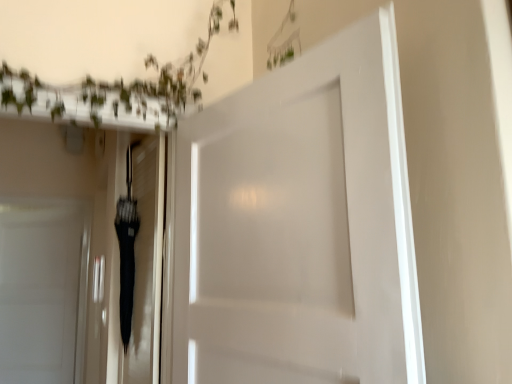
Describe the element at coordinates (42, 290) in the screenshot. The width and height of the screenshot is (512, 384). I see `white matte door at left, the first door positioned from the back` at that location.

What do you see at coordinates (300, 225) in the screenshot? I see `white matte door at center, positioned as the second door in left-to-right order` at bounding box center [300, 225].

Find the location of a particular element. Image resolution: width=512 pixels, height=384 pixels. white matte door at left, the first door positioned from the back is located at coordinates [42, 290].

From the picture: Measure the distance between white matte door at center, positioned as the second door in left-to-right order, and black glossy umbrella at center.

They are 56.75 centimeters apart.

From the image's perspective, is white matte door at center, positioned as the second door in left-to-right order, on top of black glossy umbrella at center?

Yes.

Is white matte door at center, placed as the first door when sorted from right to left, wider or thinner than black glossy umbrella at center?

Clearly, white matte door at center, placed as the first door when sorted from right to left, has more width compared to black glossy umbrella at center.

Is white matte door at center, placed as the first door when sorted from right to left, turned away from black glossy umbrella at center?

No, white matte door at center, placed as the first door when sorted from right to left, is not facing the opposite direction of black glossy umbrella at center.

Who is smaller, white matte door at left, the first door positioned from the back, or white matte door at center, placed as the first door when sorted from right to left?

white matte door at left, the first door positioned from the back.

Is white matte door at left, arranged as the first door when viewed from the left, positioned before white matte door at center, positioned as the second door in left-to-right order?

That is False.

Visually, is white matte door at left, the first door positioned from the back, positioned to the left or to the right of white matte door at center, acting as the 1th door starting from the front?

Result: white matte door at left, the first door positioned from the back, is to the left of white matte door at center, acting as the 1th door starting from the front.

This screenshot has width=512, height=384. I want to click on door behind the black glossy umbrella at center, so click(x=42, y=290).

Which of these two, white matte door at left, the second door when ordered from front to back, or black glossy umbrella at center, is wider?

black glossy umbrella at center.

Would you say white matte door at left, arranged as the first door when viewed from the left, is inside or outside black glossy umbrella at center?

white matte door at left, arranged as the first door when viewed from the left, exists outside the volume of black glossy umbrella at center.

Is white matte door at left, the second door when ordered from front to back, facing towards black glossy umbrella at center?

No, white matte door at left, the second door when ordered from front to back, does not turn towards black glossy umbrella at center.

Considering the relative positions of black glossy umbrella at center and white matte door at left, the first door positioned from the back, in the image provided, is black glossy umbrella at center to the left of white matte door at left, the first door positioned from the back, from the viewer's perspective?

No, black glossy umbrella at center is not to the left of white matte door at left, the first door positioned from the back.

From the image's perspective, is black glossy umbrella at center on white matte door at left, arranged as the second door when viewed from the right?

Yes.

From a real-world perspective, is black glossy umbrella at center under white matte door at left, arranged as the second door when viewed from the right?

Incorrect, from a real-world perspective, black glossy umbrella at center is higher than white matte door at left, arranged as the second door when viewed from the right.

Is black glossy umbrella at center positioned beyond the bounds of white matte door at left, the second door when ordered from front to back?

Yes.

Which point is more forward, (138,173) or (308,354)?

The point (308,354) is in front.

Is black glossy umbrella at center completely or partially outside of white matte door at center, the second door from the back?

That's correct, black glossy umbrella at center is outside of white matte door at center, the second door from the back.

Considering the relative sizes of black glossy umbrella at center and white matte door at center, the second door from the back, in the image provided, is black glossy umbrella at center smaller than white matte door at center, the second door from the back,?

Correct, black glossy umbrella at center occupies less space than white matte door at center, the second door from the back.

How much distance is there between black glossy umbrella at center and white matte door at center, the second door from the back?

They are 56.75 centimeters apart.

Between point (260, 275) and point (75, 216), which one is positioned in front?

Point (260, 275)

Is white matte door at center, placed as the first door when sorted from right to left, in front of or behind white matte door at left, arranged as the first door when viewed from the left, in the image?

Clearly, white matte door at center, placed as the first door when sorted from right to left, is in front of white matte door at left, arranged as the first door when viewed from the left.

Which object is wider, white matte door at center, placed as the first door when sorted from right to left, or white matte door at left, arranged as the second door when viewed from the right?

With larger width is white matte door at center, placed as the first door when sorted from right to left.

Looking at this image, is white matte door at center, placed as the first door when sorted from right to left, aimed at white matte door at left, arranged as the first door when viewed from the left?

No, white matte door at center, placed as the first door when sorted from right to left, is not aimed at white matte door at left, arranged as the first door when viewed from the left.

Image resolution: width=512 pixels, height=384 pixels. Find the location of `door located in front of the black glossy umbrella at center`. door located in front of the black glossy umbrella at center is located at coordinates (300, 225).

This screenshot has height=384, width=512. I want to click on door behind the white matte door at center, the second door from the back, so click(x=42, y=290).

Which object lies nearer to the anchor point white matte door at center, positioned as the second door in left-to-right order, black glossy umbrella at center or white matte door at left, arranged as the first door when viewed from the left?

black glossy umbrella at center lies closer to white matte door at center, positioned as the second door in left-to-right order, than the other object.

Estimate the real-world distances between objects in this image. Which object is closer to white matte door at center, positioned as the second door in left-to-right order, white matte door at left, arranged as the second door when viewed from the right, or black glossy umbrella at center?

Among the two, black glossy umbrella at center is located nearer to white matte door at center, positioned as the second door in left-to-right order.

Looking at this image, considering their positions, is white matte door at left, arranged as the first door when viewed from the left, positioned further to black glossy umbrella at center than white matte door at center, acting as the 1th door starting from the front?

white matte door at left, arranged as the first door when viewed from the left, is positioned further to the anchor black glossy umbrella at center.

Looking at the image, which one is located further to black glossy umbrella at center, white matte door at center, placed as the first door when sorted from right to left, or white matte door at left, arranged as the first door when viewed from the left?

white matte door at left, arranged as the first door when viewed from the left, is further to black glossy umbrella at center.

Considering their positions, is white matte door at center, the second door from the back, positioned closer to white matte door at left, arranged as the first door when viewed from the left, than black glossy umbrella at center?

Among the two, black glossy umbrella at center is located nearer to white matte door at left, arranged as the first door when viewed from the left.

When comparing their distances from white matte door at left, the second door when ordered from front to back, does black glossy umbrella at center or white matte door at center, the second door from the back, seem closer?

The object closer to white matte door at left, the second door when ordered from front to back, is black glossy umbrella at center.

Where is `elevator positioned between white matte door at center, the second door from the back, and white matte door at left, the second door when ordered from front to back, from near to far`? The width and height of the screenshot is (512, 384). elevator positioned between white matte door at center, the second door from the back, and white matte door at left, the second door when ordered from front to back, from near to far is located at coordinates (146, 260).